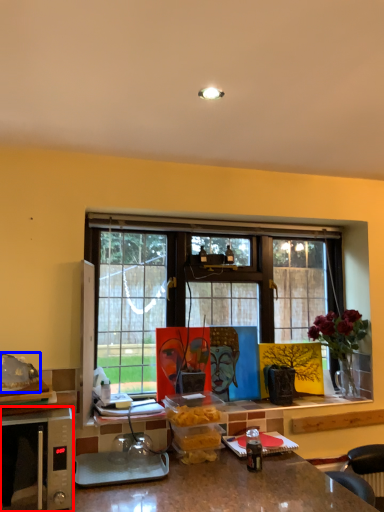
Question: Which of the following is the closest to the observer, microwave oven (highlighted by a red box) or food (highlighted by a blue box)?

Choices:
 (A) microwave oven
 (B) food

Answer: (A)